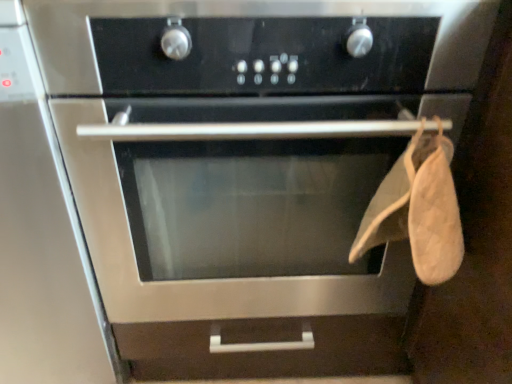
The image size is (512, 384). I want to click on stainless steel oven at center, so click(x=42, y=237).

What do you see at coordinates (42, 237) in the screenshot?
I see `stainless steel oven at center` at bounding box center [42, 237].

Locate an element on the screen. This screenshot has height=384, width=512. stainless steel oven at center is located at coordinates (42, 237).